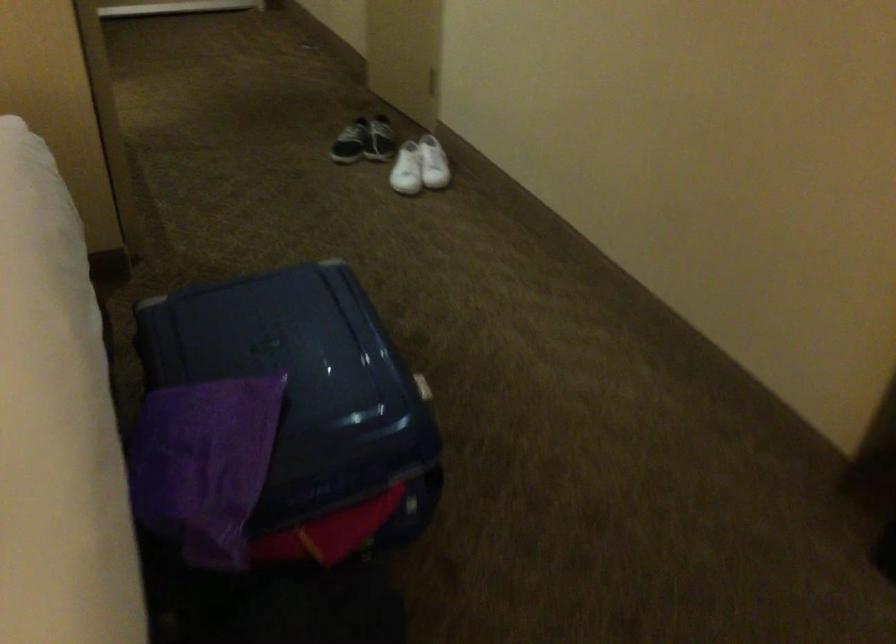
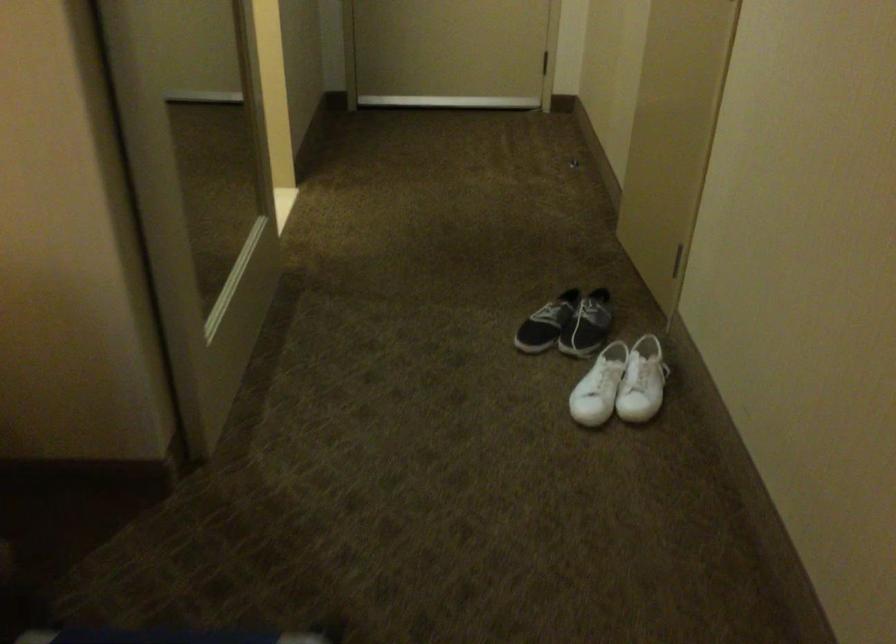
In the second image, find the point that corresponds to point 434,161 in the first image.

(642, 382)